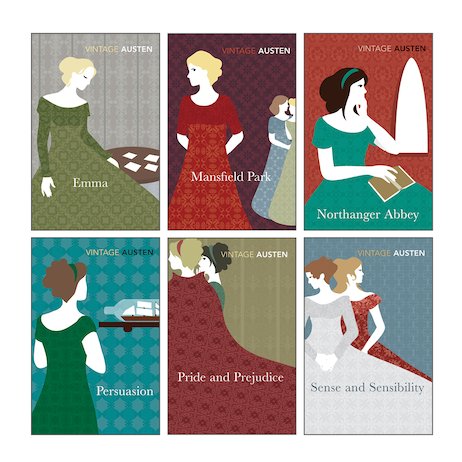
This screenshot has width=462, height=462. In order to click on shelf in this screenshot , I will do `click(128, 326)`.